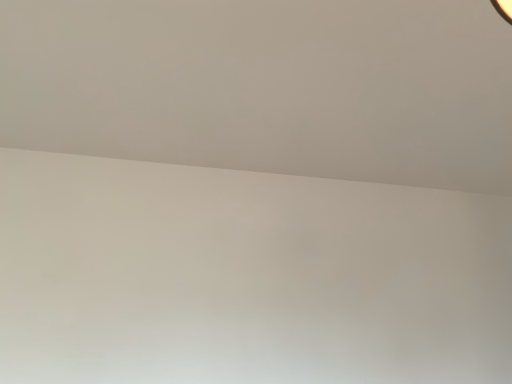
In order to face white matte wall at upper center, should I rotate leftwards or rightwards?

You should look right and rotate roughly 13.369 degrees.

Where is `white matte wall at upper center`? Image resolution: width=512 pixels, height=384 pixels. white matte wall at upper center is located at coordinates pyautogui.click(x=267, y=86).

What do you see at coordinates (267, 86) in the screenshot?
I see `white matte wall at upper center` at bounding box center [267, 86].

Locate an element on the screen. Image resolution: width=512 pixels, height=384 pixels. white matte wall at upper center is located at coordinates (267, 86).